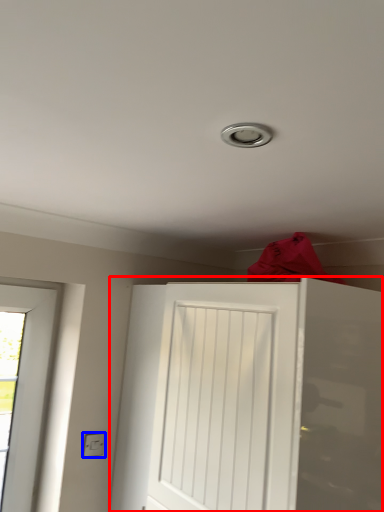
Question: Which of the following is the closest to the observer, door (highlighted by a red box) or electric outlet (highlighted by a blue box)?

Choices:
 (A) door
 (B) electric outlet

Answer: (A)